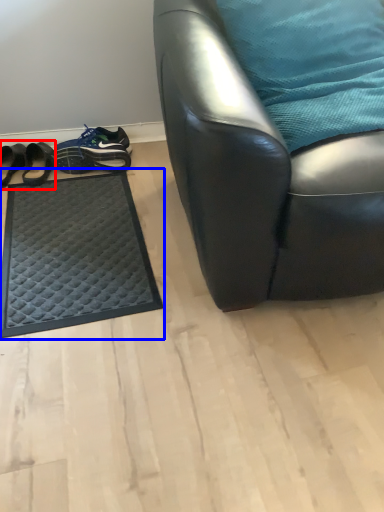
Question: Which of the following is the farthest to the observer, footwear (highlighted by a red box) or mat (highlighted by a blue box)?

Choices:
 (A) footwear
 (B) mat

Answer: (A)